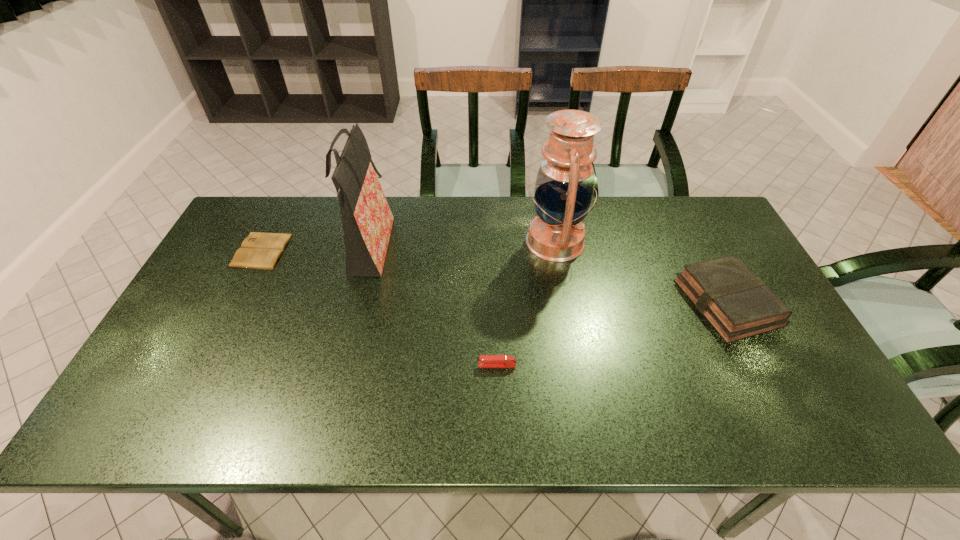
Find the location of a particular element. The width and height of the screenshot is (960, 540). object located at the far left corner is located at coordinates click(262, 251).

Where is `vacant space at the far edge of the desktop`? vacant space at the far edge of the desktop is located at coordinates (450, 225).

Image resolution: width=960 pixels, height=540 pixels. I want to click on vacant space at the near edge of the desktop, so click(708, 410).

In the image, there is a desktop. Where is `blank space at the left edge`? This screenshot has height=540, width=960. blank space at the left edge is located at coordinates (196, 397).

In the image, there is a desktop. Where is `vacant space at the right edge`? This screenshot has height=540, width=960. vacant space at the right edge is located at coordinates (780, 389).

The height and width of the screenshot is (540, 960). In order to click on free space between the fourth object from left to right and the leftmost object in this screenshot , I will do `click(409, 246)`.

Identify the location of vacant area that lies between the oil lamp and the second shortest object. The height and width of the screenshot is (540, 960). (526, 303).

You are a GUI agent. You are given a task and a screenshot of the screen. Output one action in this format:
    pyautogui.click(x=<x>, y=<y>)
    Task: Click on the vacant space that is in between the second object from left to right and the taller book
    Image resolution: width=960 pixels, height=540 pixels.
    Given the screenshot: What is the action you would take?
    pyautogui.click(x=548, y=276)

Where is `free space that is in between the fourth object from right to left and the fourth tallest object`? The image size is (960, 540). free space that is in between the fourth object from right to left and the fourth tallest object is located at coordinates (433, 307).

The width and height of the screenshot is (960, 540). I want to click on empty space that is in between the leftmost object and the rightmost object, so coord(494,276).